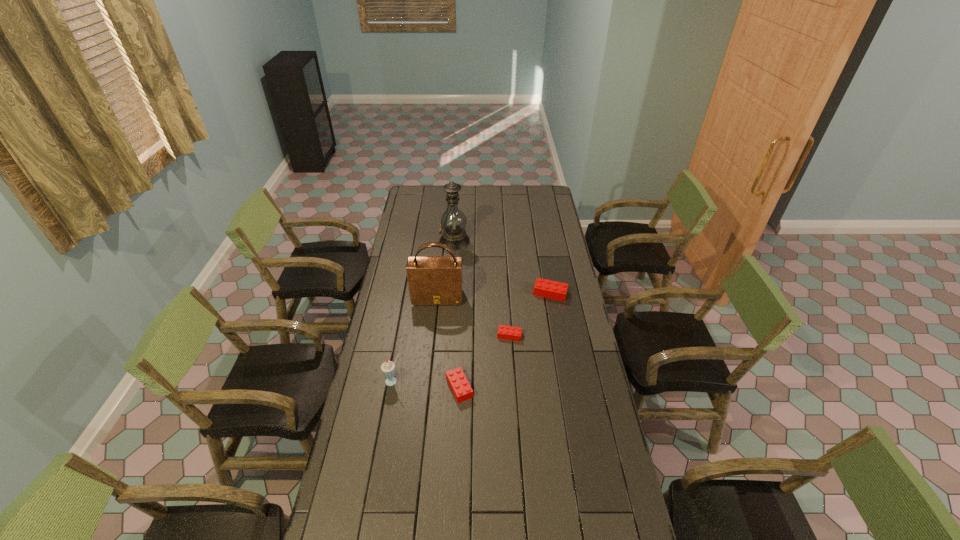
Where is `free space at the right edge`? free space at the right edge is located at coordinates (613, 498).

Find the location of a particular element. vacant space at the far left corner is located at coordinates (420, 204).

At what (x,y) coordinates should I click in order to perform the action: click on unoccupied position between the shoulder bag and the leftmost Lego. Please return your answer as a coordinate pair (x, y). Looking at the image, I should click on (448, 342).

At what (x,y) coordinates should I click in order to perform the action: click on unoccupied position between the fourth shortest object and the tallest Lego. Please return your answer as a coordinate pair (x, y). The height and width of the screenshot is (540, 960). Looking at the image, I should click on (471, 338).

Find the location of `free spot between the second tallest object and the second shortest Lego`. free spot between the second tallest object and the second shortest Lego is located at coordinates (448, 342).

Locate an element on the screen. free spot between the milkshake and the shoulder bag is located at coordinates 416,339.

What are the coordinates of `vacant space that is in between the fifth object from left to right and the farthest object` in the screenshot? It's located at (482, 288).

Locate an element on the screen. free space that is in between the fourth shortest object and the second Lego from left to right is located at coordinates (451, 359).

Image resolution: width=960 pixels, height=540 pixels. I want to click on empty location between the second Lego from left to right and the milkshake, so click(451, 359).

The image size is (960, 540). I want to click on free space between the second shortest object and the second farthest Lego, so click(485, 361).